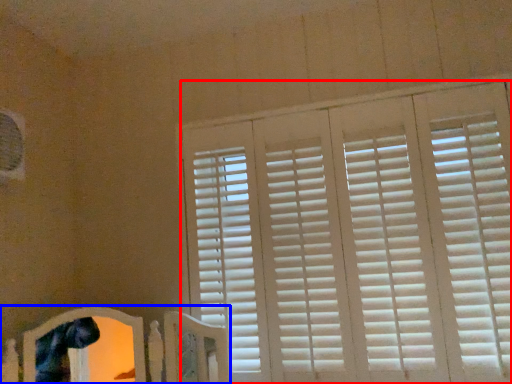
Question: Which object is further to the camera taking this photo, window blind (highlighted by a red box) or bed frame (highlighted by a blue box)?

Choices:
 (A) window blind
 (B) bed frame

Answer: (A)